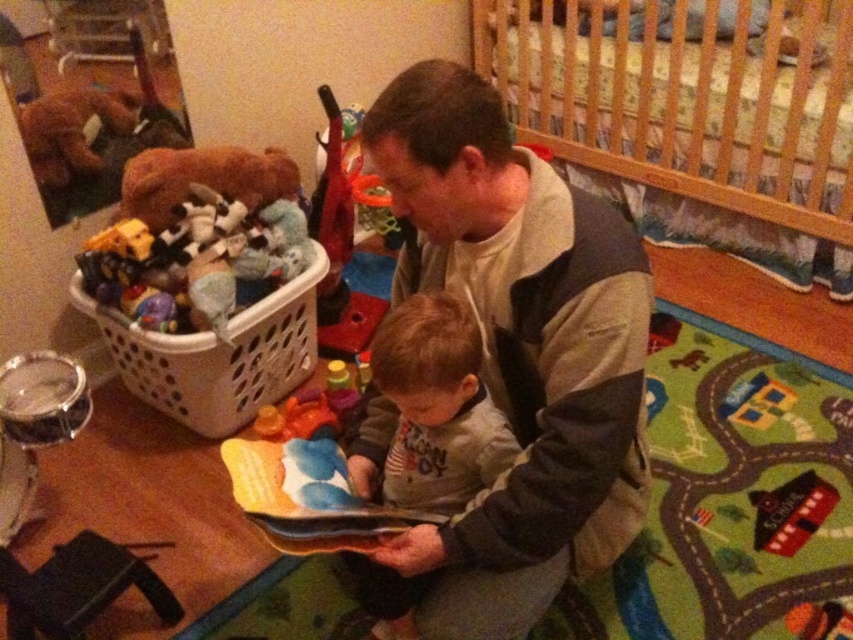
In the scene shown: You are a parent looking for a toy to give your child. You see the gray cotton shirt at center and the white plastic basket at left. Which one is closer to you?

The gray cotton shirt at center is closer to you because it is in front of the white plastic basket at left.

You are a parent trying to dress your child. You have a gray fleece jacket at center and a gray cotton shirt at center. Which clothing item should you put on first according to the spatial arrangement?

The gray cotton shirt at center should be put on first because the gray fleece jacket at center is above it, indicating it is already worn over the shirt.